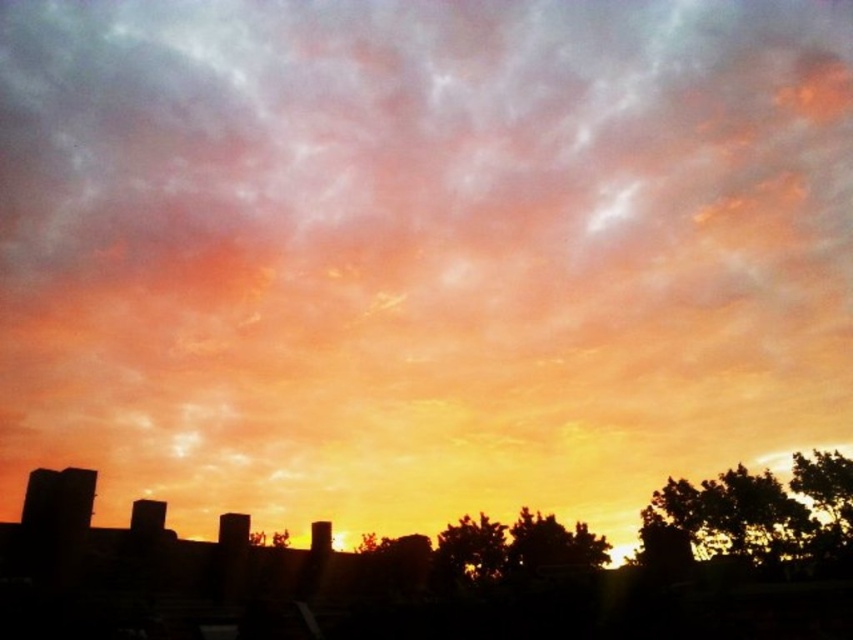
Question: Is dark green leafy tree at lower right positioned at the back of green leafy tree at lower right?

Choices:
 (A) yes
 (B) no

Answer: (B)

Question: Estimate the real-world distances between objects in this image. Which object is farther from the dark green leafy tree at lower right?

Choices:
 (A) green leafy tree at center
 (B) green leafy tree at lower right

Answer: (A)

Question: Where is dark green leafy tree at lower right located in relation to green leafy tree at center in the image?

Choices:
 (A) above
 (B) below

Answer: (A)

Question: Estimate the real-world distances between objects in this image. Which object is farther from the green leafy tree at lower right?

Choices:
 (A) green leafy tree at center
 (B) dark green leafy tree at lower right

Answer: (A)

Question: Does dark green leafy tree at lower right have a smaller size compared to green leafy tree at lower right?

Choices:
 (A) no
 (B) yes

Answer: (A)

Question: Which point is farther from the camera taking this photo?

Choices:
 (A) (846, 525)
 (B) (450, 556)
 (C) (691, 493)

Answer: (C)